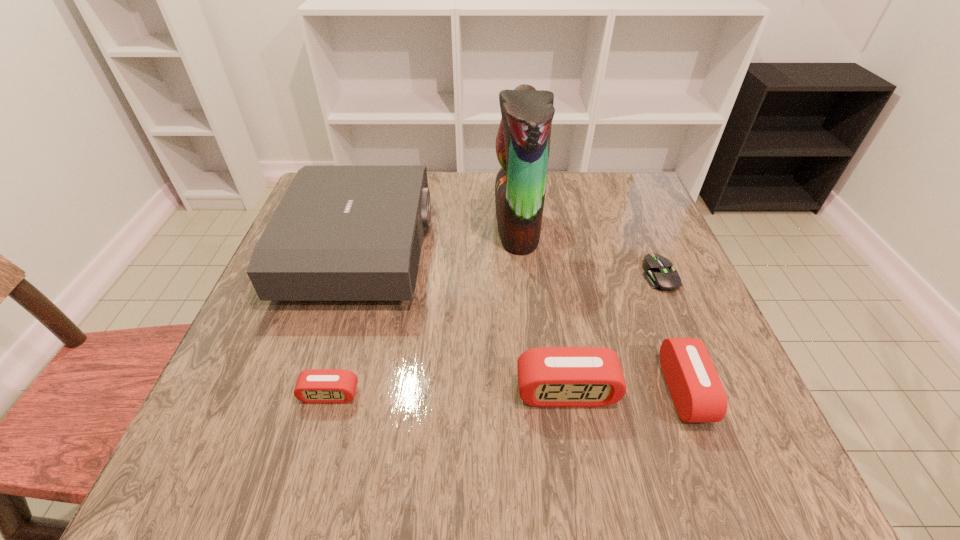
Identify which alarm clock is the second closest to the tallest object. Please provide its 2D coordinates. Your answer should be formatted as a tuple, i.e. [(x, y)], where the tuple contains the x and y coordinates of a point satisfying the conditions above.

[(697, 392)]

Image resolution: width=960 pixels, height=540 pixels. In order to click on the second closest alarm clock relative to the second tallest alarm clock in this screenshot , I will do `click(315, 385)`.

Find the location of a particular element. The height and width of the screenshot is (540, 960). free spot that satisfies the following two spatial constraints: 1. on the front side of the shortest object; 2. on the front-facing side of the third shortest object is located at coordinates (709, 390).

The width and height of the screenshot is (960, 540). In order to click on blank area in the image that satisfies the following two spatial constraints: 1. on the back side of the shortest object; 2. on the front-facing side of the projector in this screenshot , I will do `click(649, 249)`.

Where is `free spot that satisfies the following two spatial constraints: 1. on the front side of the shortest object; 2. on the front-facing side of the third shortest object`? free spot that satisfies the following two spatial constraints: 1. on the front side of the shortest object; 2. on the front-facing side of the third shortest object is located at coordinates (709, 390).